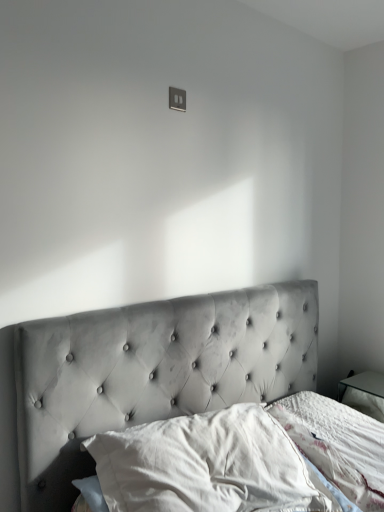
The width and height of the screenshot is (384, 512). What do you see at coordinates (177, 99) in the screenshot? I see `matte gray switch at upper center` at bounding box center [177, 99].

Locate an element on the screen. matte gray switch at upper center is located at coordinates (177, 99).

What is the approximate width of matte gray switch at upper center?

1.92 centimeters.

Measure the distance between point (178, 104) and camera.

Point (178, 104) is 1.75 meters away from camera.

Describe the element at coordinates (205, 466) in the screenshot. I see `white soft pillow at lower center` at that location.

In order to face white soft pillow at lower center, should I rotate leftwards or rightwards?

Turn right approximately 1.786 degrees to face it.

Image resolution: width=384 pixels, height=512 pixels. I want to click on white soft pillow at lower center, so click(x=205, y=466).

You are a GUI agent. You are given a task and a screenshot of the screen. Output one action in this format:
    pyautogui.click(x=<x>, y=<y>)
    Task: Click on the matte gray switch at upper center
    Image resolution: width=384 pixels, height=512 pixels.
    Given the screenshot: What is the action you would take?
    pyautogui.click(x=177, y=99)

Is white soft pillow at lower center at the left side of matte gray switch at upper center?

In fact, white soft pillow at lower center is to the right of matte gray switch at upper center.

Is white soft pillow at lower center positioned in front of matte gray switch at upper center?

Yes, white soft pillow at lower center is closer to the viewer.

Which is closer, (x=256, y=419) or (x=172, y=108)?

Point (x=256, y=419) is closer to the camera than point (x=172, y=108).

Consider the image. From the image's perspective, is white soft pillow at lower center over matte gray switch at upper center?

No, from the image's perspective, white soft pillow at lower center is not over matte gray switch at upper center.

From a real-world perspective, which is physically below, white soft pillow at lower center or matte gray switch at upper center?

white soft pillow at lower center is physically lower.

Is white soft pillow at lower center wider than matte gray switch at upper center?

Yes.

Is white soft pillow at lower center shorter than matte gray switch at upper center?

No.

Based on their sizes in the image, would you say white soft pillow at lower center is bigger or smaller than matte gray switch at upper center?

Clearly, white soft pillow at lower center is larger in size than matte gray switch at upper center.

Does white soft pillow at lower center contain matte gray switch at upper center?

No, matte gray switch at upper center is located outside of white soft pillow at lower center.

Would you say white soft pillow at lower center is a long distance from matte gray switch at upper center?

Yes, white soft pillow at lower center is far from matte gray switch at upper center.

Is white soft pillow at lower center facing away from matte gray switch at upper center?

white soft pillow at lower center is not turned away from matte gray switch at upper center.

You are a GUI agent. You are given a task and a screenshot of the screen. Output one action in this format:
    pyautogui.click(x=<x>, y=<y>)
    Task: Click on the pillow below the matte gray switch at upper center (from the image's perspective)
    
    Given the screenshot: What is the action you would take?
    pyautogui.click(x=205, y=466)

Does matte gray switch at upper center appear on the left side of white soft pillow at lower center?

Yes, matte gray switch at upper center is to the left of white soft pillow at lower center.

Which object is further away from the camera taking this photo, matte gray switch at upper center or white soft pillow at lower center?

matte gray switch at upper center is further away from the camera.

Which is closer to the camera, (180,103) or (224,467)?

Point (180,103) appears to be farther away from the viewer than point (224,467).

From the image's perspective, is matte gray switch at upper center above or below white soft pillow at lower center?

matte gray switch at upper center is above white soft pillow at lower center.

Based on the photo, from a real-world perspective, does matte gray switch at upper center stand above white soft pillow at lower center?

Correct, in the physical world, matte gray switch at upper center is higher than white soft pillow at lower center.

Can you confirm if matte gray switch at upper center is thinner than white soft pillow at lower center?

Yes, matte gray switch at upper center is thinner than white soft pillow at lower center.

In terms of height, does matte gray switch at upper center look taller or shorter compared to white soft pillow at lower center?

matte gray switch at upper center is shorter than white soft pillow at lower center.

Who is bigger, matte gray switch at upper center or white soft pillow at lower center?

white soft pillow at lower center.

Is white soft pillow at lower center located within matte gray switch at upper center?

Definitely not — white soft pillow at lower center is not inside matte gray switch at upper center.

Is matte gray switch at upper center next to white soft pillow at lower center?

No, matte gray switch at upper center is not touching white soft pillow at lower center.

Is matte gray switch at upper center turned away from white soft pillow at lower center?

matte gray switch at upper center is not turned away from white soft pillow at lower center.

From the picture: How different are the orientations of matte gray switch at upper center and white soft pillow at lower center in degrees?

The angular difference between matte gray switch at upper center and white soft pillow at lower center is 0.465 degrees.

This screenshot has height=512, width=384. I want to click on pillow in front of the matte gray switch at upper center, so click(x=205, y=466).

Where is `electric outlet that appears behind the white soft pillow at lower center`? Image resolution: width=384 pixels, height=512 pixels. electric outlet that appears behind the white soft pillow at lower center is located at coordinates (177, 99).

This screenshot has width=384, height=512. What are the coordinates of `electric outlet above the white soft pillow at lower center (from the image's perspective)` in the screenshot? It's located at (177, 99).